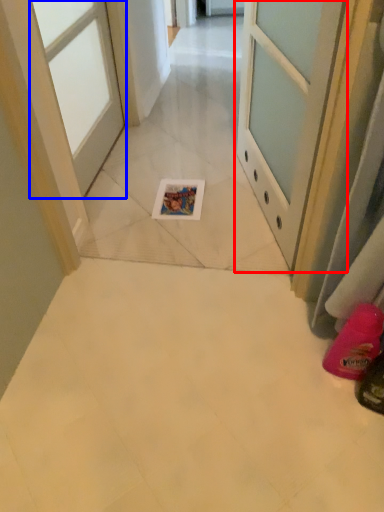
Question: Which object is closer to the camera taking this photo, door (highlighted by a red box) or door (highlighted by a blue box)?

Choices:
 (A) door
 (B) door

Answer: (A)